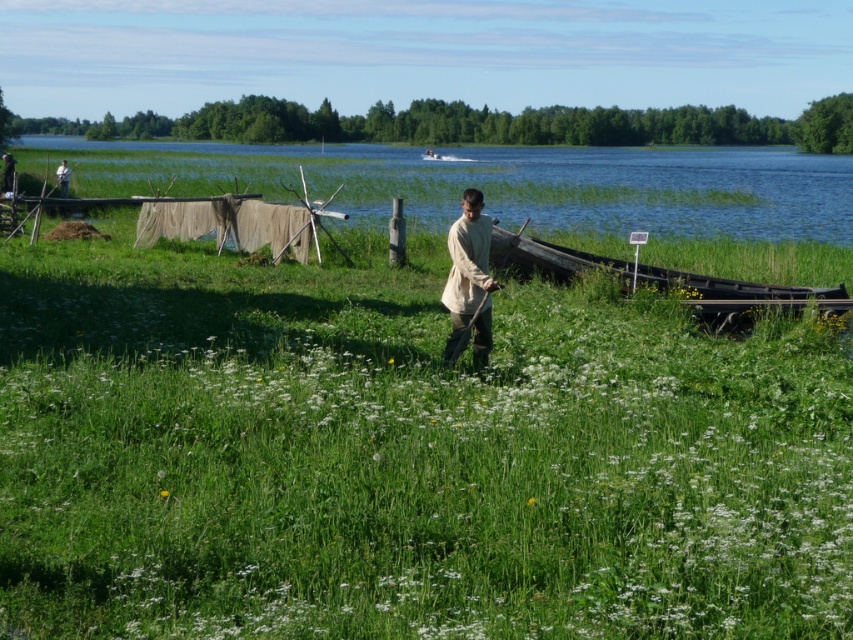
Is blue water at upper center to the left of dark brown wooden canoe at right from the viewer's perspective?

In fact, blue water at upper center is to the right of dark brown wooden canoe at right.

Which of these two, blue water at upper center or dark brown wooden canoe at right, stands taller?

blue water at upper center is taller.

At what (x,y) coordinates should I click in order to perform the action: click on blue water at upper center. Please return your answer as a coordinate pair (x, y). This screenshot has width=853, height=640. Looking at the image, I should click on (502, 182).

This screenshot has height=640, width=853. In order to click on blue water at upper center in this screenshot , I will do `click(502, 182)`.

Can you confirm if green grassy at center is positioned to the right of dark brown wooden canoe at right?

In fact, green grassy at center is to the left of dark brown wooden canoe at right.

Who is shorter, green grassy at center or dark brown wooden canoe at right?

Standing shorter between the two is dark brown wooden canoe at right.

Locate an element on the screen. green grassy at center is located at coordinates (404, 456).

Where is `green grassy at center`? The width and height of the screenshot is (853, 640). green grassy at center is located at coordinates (404, 456).

Does point (622, 330) lie in front of point (500, 214)?

Yes, it is in front of point (500, 214).

Is green grassy at center bigger than blue water at upper center?

No, green grassy at center is not bigger than blue water at upper center.

Between point (3, 525) and point (15, 148), which one is positioned in front?

Point (3, 525) is in front.

This screenshot has width=853, height=640. Identify the location of green grassy at center. (404, 456).